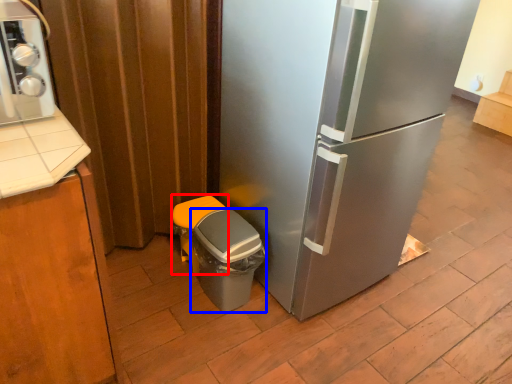
Question: Which object is closer to the camera taking this photo, garbage (highlighted by a red box) or potty (highlighted by a blue box)?

Choices:
 (A) garbage
 (B) potty

Answer: (B)